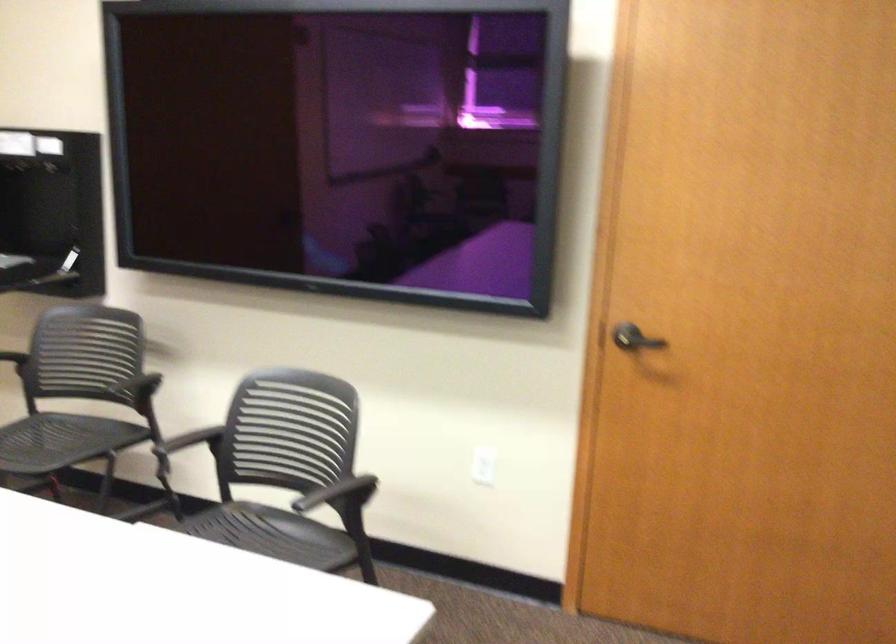
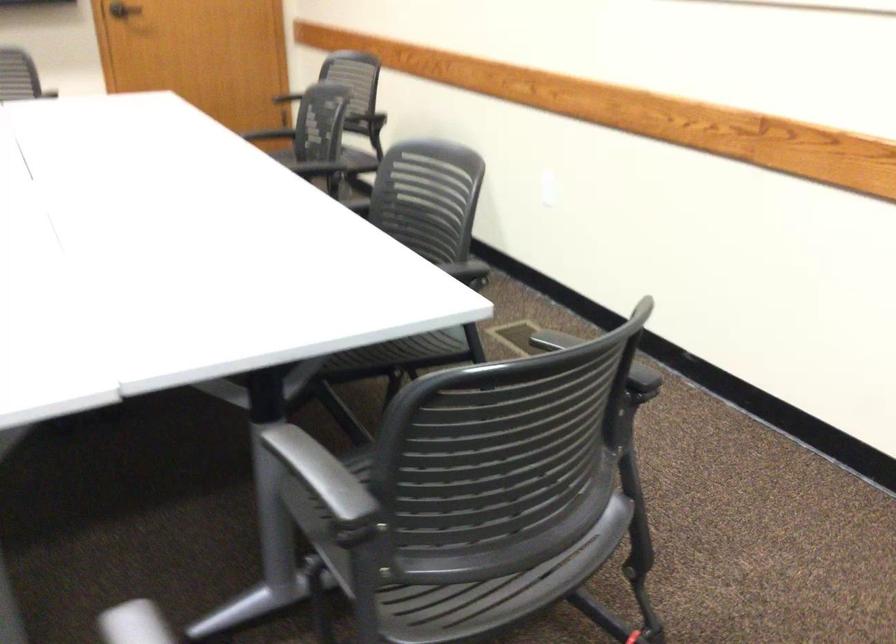
Locate, in the second image, the point that corresponds to (x=604, y=348) in the first image.

(123, 10)